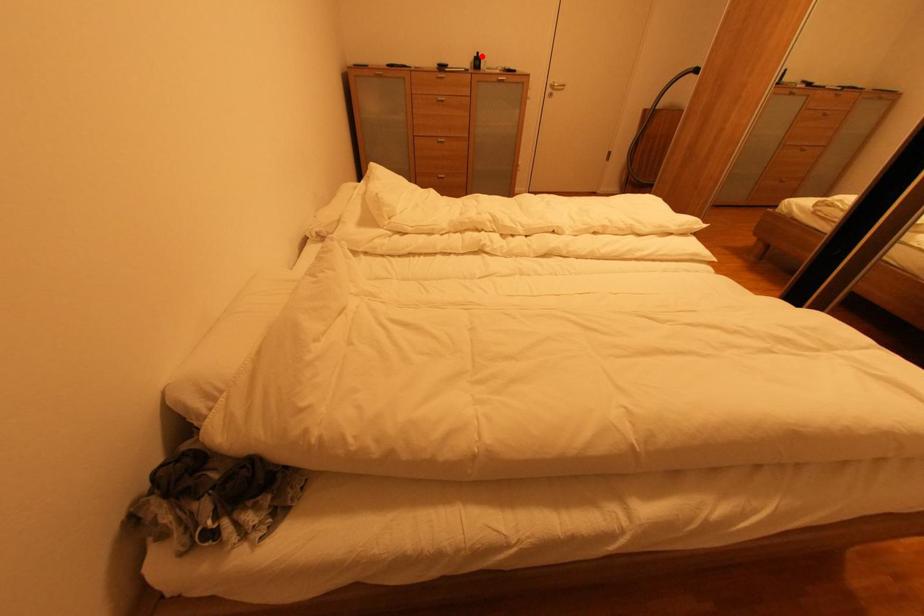
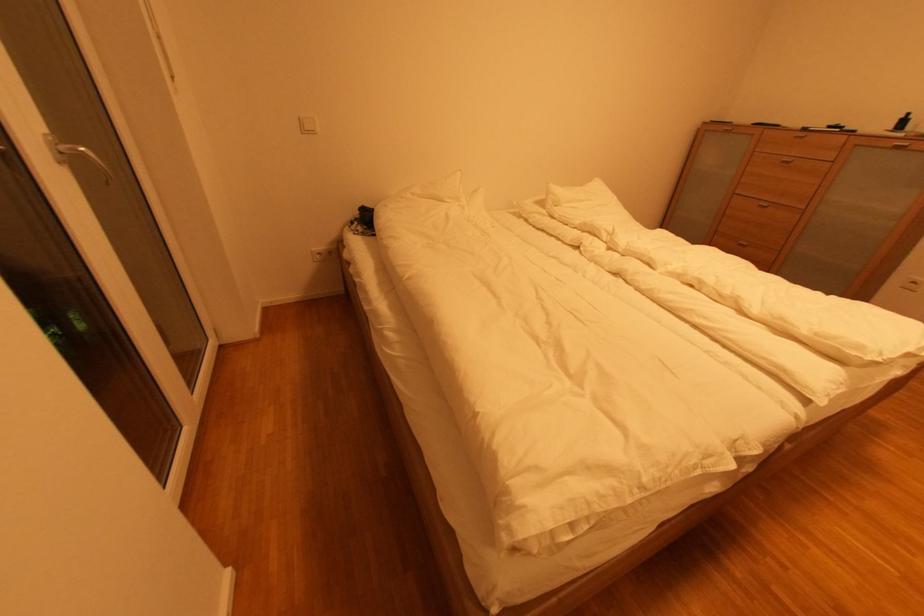
Question: I am providing you with two images of the same scene from different viewpoints. A red point is shown in image1. For the corresponding object point in image2, is it positioned nearer or farther from the camera?

Choices:
 (A) Nearer
 (B) Farther

Answer: (B)